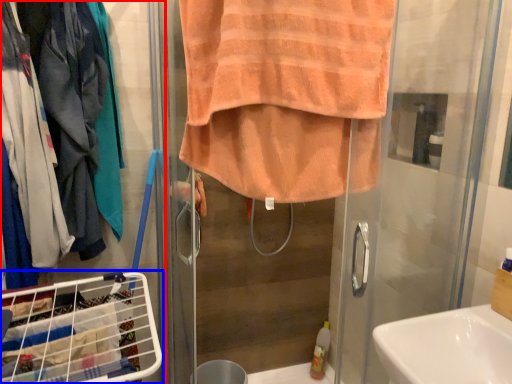
Question: Which point is further to the camera, closet (highlighted by a red box) or laundry basket (highlighted by a blue box)?

Choices:
 (A) closet
 (B) laundry basket

Answer: (A)